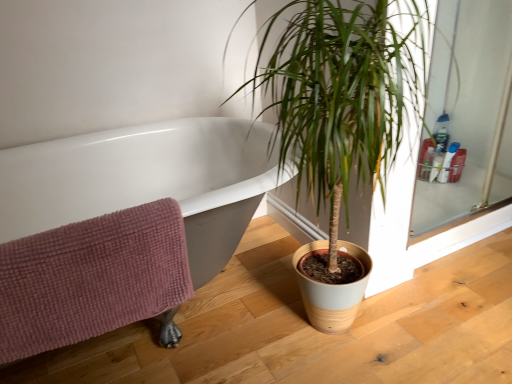
The height and width of the screenshot is (384, 512). In order to click on blank space to the left of translucent plastic bottle at upper right, which ranks as the 3th toiletry in left-to-right order in this screenshot , I will do `click(434, 193)`.